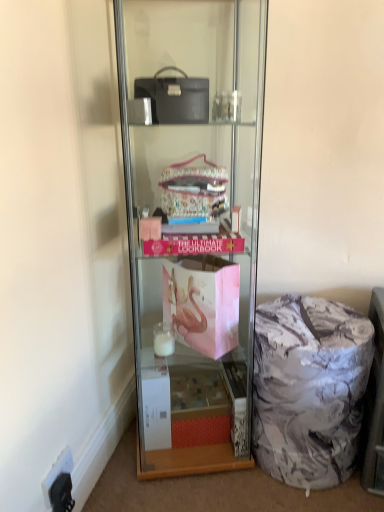
Question: Considering the positions of marble-patterned ottoman at lower right and black plastic electric outlet at lower left in the image, is marble-patterned ottoman at lower right taller or shorter than black plastic electric outlet at lower left?

Choices:
 (A) short
 (B) tall

Answer: (B)

Question: Considering the relative positions of marble-patterned ottoman at lower right and black plastic electric outlet at lower left in the image provided, is marble-patterned ottoman at lower right to the left or to the right of black plastic electric outlet at lower left?

Choices:
 (A) right
 (B) left

Answer: (A)

Question: Considering the real-world distances, which object is closest to the clear glass shelf at center?

Choices:
 (A) black plastic electric outlet at lower left
 (B) marble-patterned fabric bag at lower right
 (C) marble-patterned ottoman at lower right

Answer: (B)

Question: Estimate the real-world distances between objects in this image. Which object is farther from the marble-patterned ottoman at lower right?

Choices:
 (A) marble-patterned fabric bag at lower right
 (B) black plastic electric outlet at lower left
 (C) clear glass shelf at center

Answer: (B)